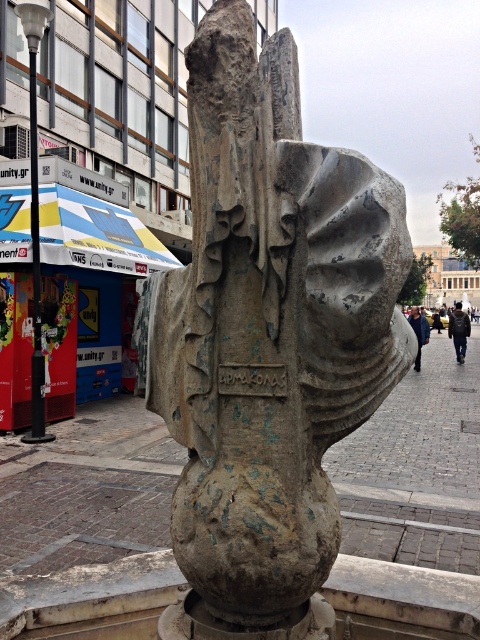
You are a maintenance worker tasked with cleaning the area around the rusty stone sculpture at center and the brick pavement at center. Your cleaning equipment is 3 feet wide. Can you safely maneuver your equipment between the sculpture and the pavement without hitting either?

The distance between the rusty stone sculpture at center and the brick pavement at center is 8.72 feet. Since your equipment is only 3 feet wide, there is sufficient space to maneuver safely between them without any collisions.

You are a tourist standing in the plaza and want to take a photo of the rusty stone sculpture at center without the brick pavement at center appearing in the background. Is this possible based on their positions?

The rusty stone sculpture at center is in front of the brick pavement at center, so you can position yourself so that the sculpture blocks the view of the brick pavement at center, making it possible to take a photo without the pavement in the background.

You are standing in the public square and want to take a photo of the rusty stone sculpture at center. If you are currently at the coordinates 0.4, 0.6, which direction should you move to face the sculpture?

The rusty stone sculpture at center is located at coordinates (267,339). Since your current position is (288,256), you should move southeast to face the sculpture.